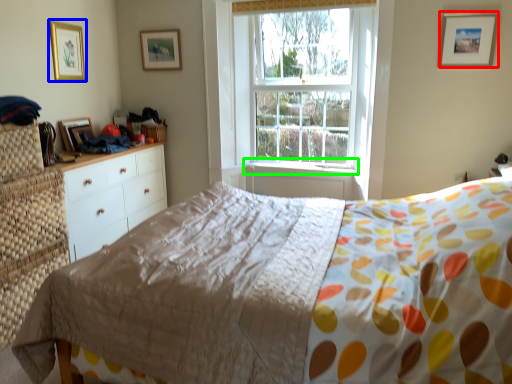
Question: Which object is positioned farthest from picture frame (highlighted by a red box)? Select from picture frame (highlighted by a blue box) and window sill (highlighted by a green box).

Choices:
 (A) picture frame
 (B) window sill

Answer: (A)